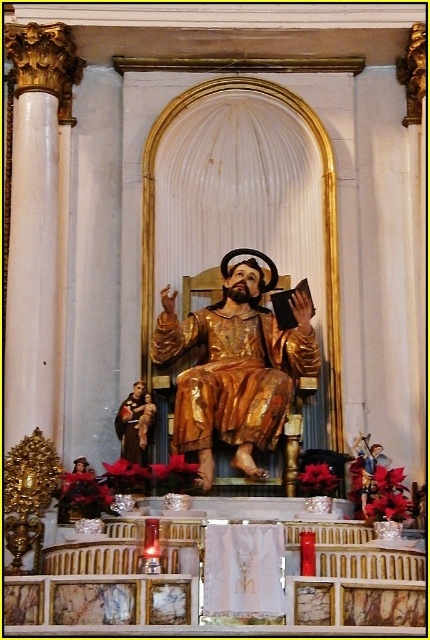
Looking at this image, which is more to the right, matte gold statue at center or golden statue at center?

golden statue at center

Does point (146, 397) lie in front of point (138, 444)?

No, (146, 397) is further to viewer.

Is point (138, 417) in front of point (141, 419)?

No, it is behind (141, 419).

This screenshot has height=640, width=430. I want to click on matte gold statue at center, so click(135, 422).

Can you confirm if gold statue at center is bigger than golden statue at center?

Actually, gold statue at center might be smaller than golden statue at center.

Is gold statue at center above golden statue at center?

Incorrect, gold statue at center is not positioned above golden statue at center.

Between point (386, 461) and point (147, 392), which one is positioned behind?

Positioned behind is point (386, 461).

This screenshot has height=640, width=430. I want to click on gold statue at center, so click(368, 468).

Is gold polished statue at center wider than golden statue at center?

Correct, the width of gold polished statue at center exceeds that of golden statue at center.

Is gold polished statue at center above golden statue at center?

Yes, gold polished statue at center is above golden statue at center.

What do you see at coordinates (236, 365) in the screenshot? This screenshot has width=430, height=640. I see `gold polished statue at center` at bounding box center [236, 365].

Locate an element on the screen. gold polished statue at center is located at coordinates (236, 365).